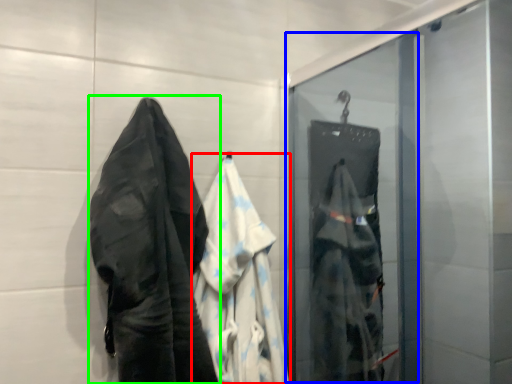
Question: Which object is positioned farthest from garment (highlighted by a red box)? Select from screen door (highlighted by a blue box) and towel (highlighted by a green box).

Choices:
 (A) screen door
 (B) towel

Answer: (A)